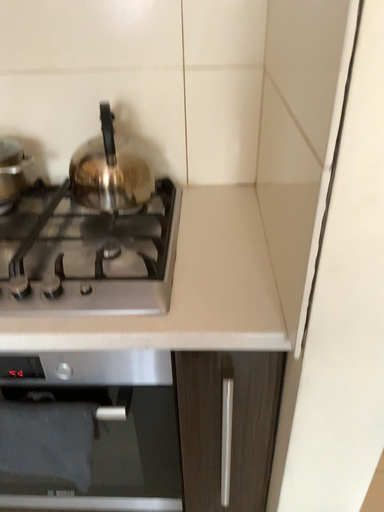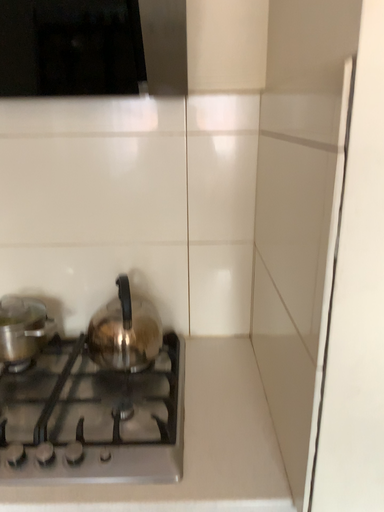
Question: How did the camera likely rotate when shooting the video?

Choices:
 (A) rotated upward
 (B) rotated downward

Answer: (A)